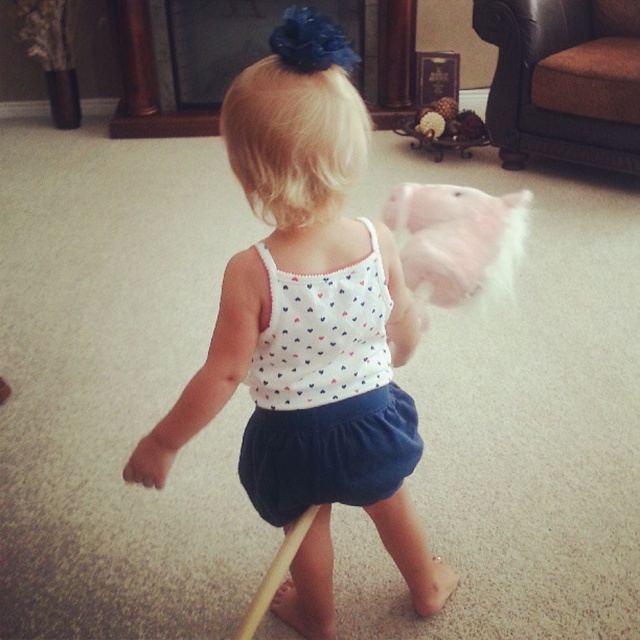
In the scene shown: You are a child wearing a white dotted tank top at center and holding a fuzzy cotton candy at center. Can you tell me which item is wider?

The white dotted tank top at center is wider than the fuzzy cotton candy at center.

You are standing in the same room as the child and want to place a small toy at point (397, 486). If the toy requires 2 feet of space in front of it to be safe, will the space be sufficient?

The distance of point (397, 486) from the viewer is 4.35 feet. Since the required space is 2 feet, the remaining distance after placing the toy would be 4.35 minus 2 equals 2.35 feet, which is enough space. Therefore, the space is sufficient.

You are a photographer trying to capture the child holding the wooden stick and the objects in the scene. Since both the white dotted fabric dress at center and the fuzzy cotton candy at center are at the center, which one will appear larger in your photo?

The white dotted fabric dress at center will appear larger in the photo because it is closer to the viewer than the fuzzy cotton candy at center.